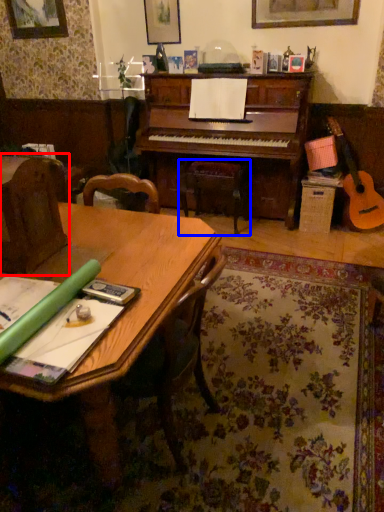
Question: Which object is closer to the camera taking this photo, armchair (highlighted by a red box) or music stool (highlighted by a blue box)?

Choices:
 (A) armchair
 (B) music stool

Answer: (A)